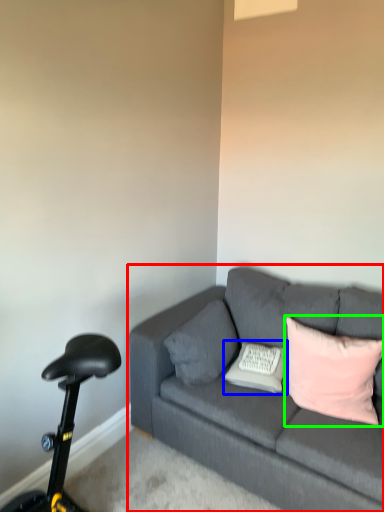
Question: Which object is the closest to the studio couch (highlighted by a red box)? Choose among these: pillow (highlighted by a blue box) or pillow (highlighted by a green box).

Choices:
 (A) pillow
 (B) pillow

Answer: (B)